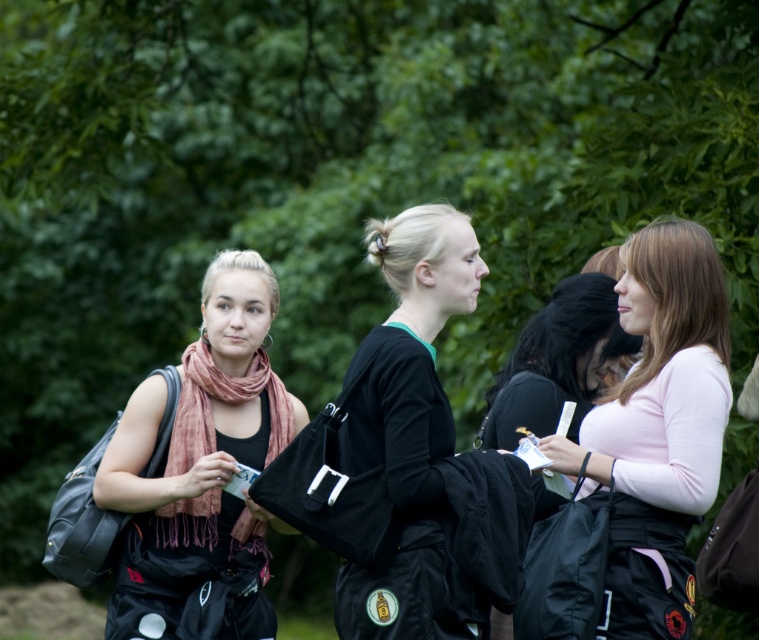
You are standing in a park and see a person wearing a pink matte shirt at right. If you want to approach them, in which direction should you move relative to your current position?

The pink matte shirt at right is located at point 0.670 on the x axis and 0.868 on the y axis, so to approach them, you should move towards the right and slightly forward.

Consider the image. You are a photographer wanting to capture a group photo of the pink matte shirt at right and the matte black jacket at right. Since you want to ensure both subjects are in focus, you need to know which one is taller. Can you determine which is taller?

The pink matte shirt at right is taller than the matte black jacket at right, so you should adjust the camera focus to accommodate the height difference between the two subjects.